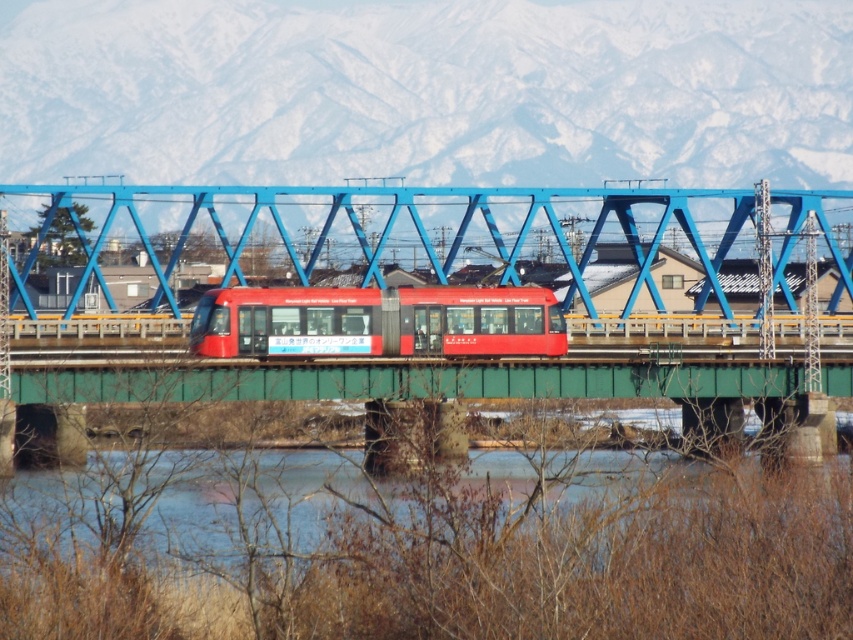
You are a passenger on the matte red train at center and want to look out the window to see the translucent ice at lower center. Which side of the train should you look towards?

The translucent ice at lower center is to the right of the matte red train at center, so you should look towards the right side of the train.

Based on the photo, you are standing on the platform waiting for the matte red train at center to pass. As it moves, you notice the blue metallic bridge at center. Which direction is the train moving relative to the bridge?

The blue metallic bridge at center is to the right of the matte red train at center, so the train is moving to the left relative to the bridge.